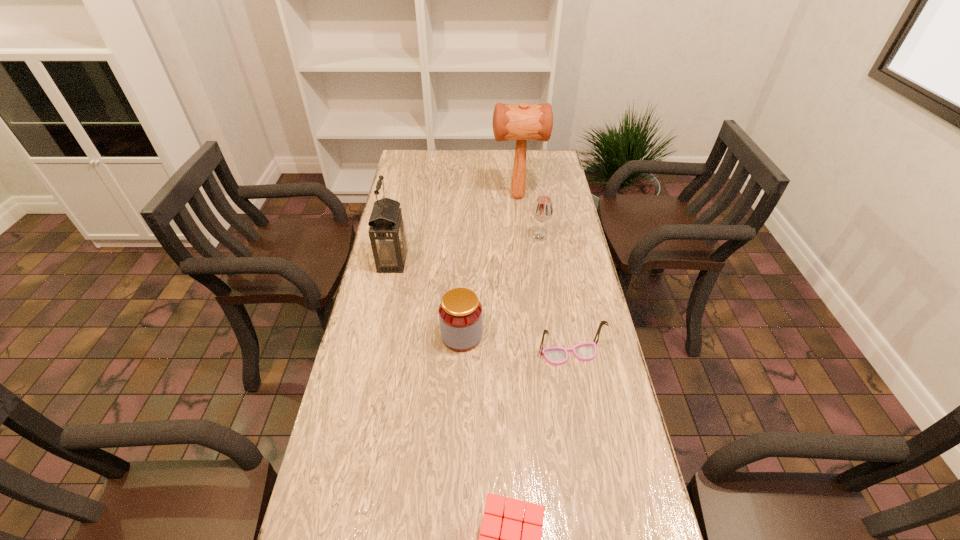
Locate which object is the second closest to the jar. Please provide its 2D coordinates. Your answer should be formatted as a tuple, i.e. [(x, y)], where the tuple contains the x and y coordinates of a point satisfying the conditions above.

[(387, 233)]

Locate an element on the screen. Image resolution: width=960 pixels, height=540 pixels. vacant area that satisfies the following two spatial constraints: 1. on the strike surface of the spectacles; 2. on the left side of the farthest object is located at coordinates (535, 354).

Identify the location of vacant position in the image that satisfies the following two spatial constraints: 1. on the strike surface of the mallet; 2. on the right side of the wineglass. (522, 237).

What are the coordinates of `free location that satisfies the following two spatial constraints: 1. on the strike surface of the mallet; 2. on the left side of the spectacles` in the screenshot? It's located at (535, 354).

Find the location of a particular element. free space that satisfies the following two spatial constraints: 1. on the strike surface of the mallet; 2. on the right side of the second farthest object is located at coordinates (522, 237).

Locate an element on the screen. This screenshot has height=540, width=960. free location that satisfies the following two spatial constraints: 1. on the back side of the jar; 2. on the left side of the wineglass is located at coordinates (466, 237).

What are the coordinates of `vacant region that satisfies the following two spatial constraints: 1. on the strike surface of the fifth nearest object; 2. on the right side of the tallest object` in the screenshot? It's located at (522, 237).

Image resolution: width=960 pixels, height=540 pixels. In order to click on blank space that satisfies the following two spatial constraints: 1. on the front-facing side of the leftmost object; 2. on the right side of the jar in this screenshot , I will do `click(376, 336)`.